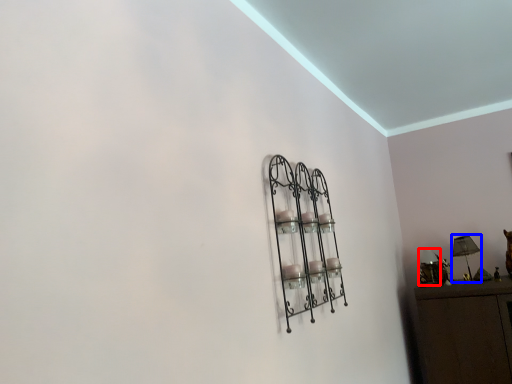
Question: Which of the following is the closest to the observer, lamp (highlighted by a red box) or table lamp (highlighted by a blue box)?

Choices:
 (A) lamp
 (B) table lamp

Answer: (B)